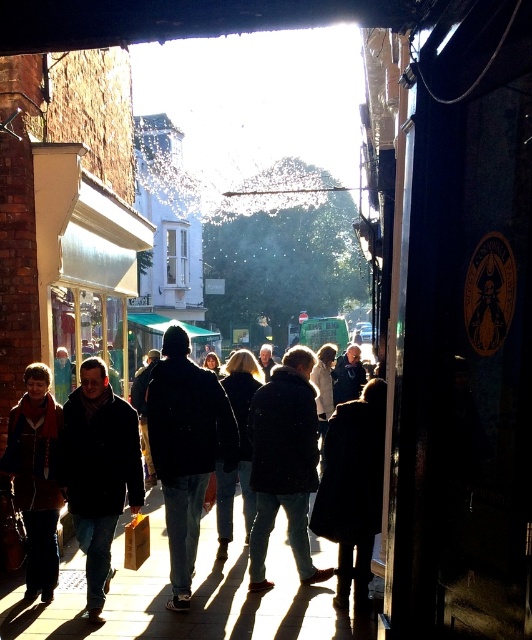
You are standing at the entrance of the building shown in the scene. There is a point marked at coordinates (187, 582) which corresponds to dark matte clothing at center. Can you tell me what is located at that point?

The point at coordinates (187, 582) marks dark matte clothing at center.

You are standing at the entrance of the building and see the dark matte clothing at center and the brown leather jacket at lower left. Which one is closer to the camera?

The brown leather jacket at lower left is closer to the camera because it is positioned to the left of the dark matte clothing at center, and in this perspective, objects on the left are typically closer.

In the scene shown: You are standing inside the building and looking out through the entrance. You see the smooth concrete pavement at center and the brown leather jacket at lower left. Which object is closer to your eye level?

The brown leather jacket at lower left is closer to your eye level because it has a greater height than the smooth concrete pavement at center.